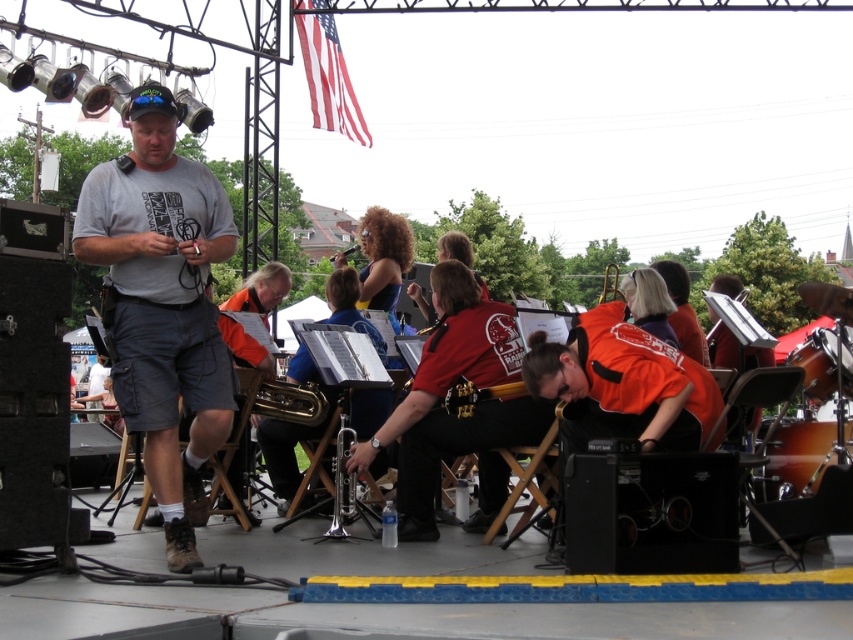
You are a photographer positioned behind the wooden drum at right and the gold metallic guitar at center. Which object is nearer to you?

The wooden drum at right is closer to the viewer than the gold metallic guitar at center, so the wooden drum at right is nearer to you.